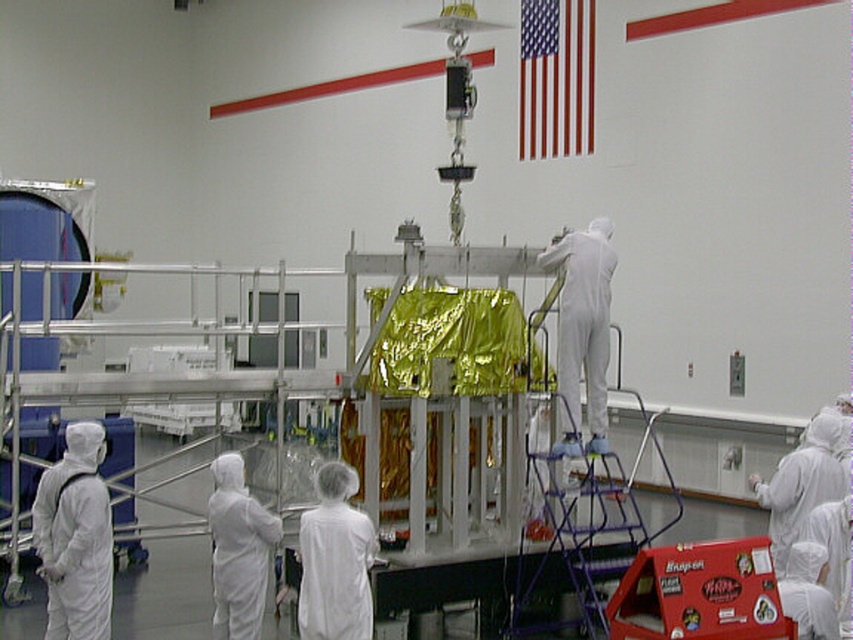
You are an engineer in the cleanroom and need to reach the suspended metallic structure. You have a blue metallic ladder at center and a white matte suit at left available. Which object should you use to climb towards the metallic structure?

The blue metallic ladder at center is smaller than the white matte suit at left, so the ladder is more appropriate for climbing towards the metallic structure since it is designed for that purpose, while the white matte suit at left is clothing and cannot be climbed.

You are an engineer in the cleanroom and need to access the suspended metallic structure. You see the blue metallic ladder at center and the white matte suit at left. Which object is closer to the crane holding the structure?

The blue metallic ladder at center is closer to the crane holding the structure because it is positioned to the right of the white matte suit at left, which is farther away from the crane.